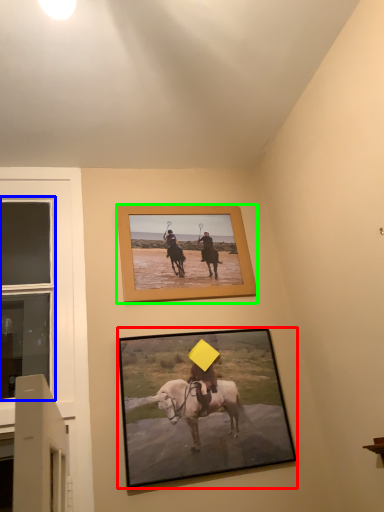
Question: Which is nearer to the picture frame (highlighted by a red box)? window (highlighted by a blue box) or picture frame (highlighted by a green box).

Choices:
 (A) window
 (B) picture frame

Answer: (B)